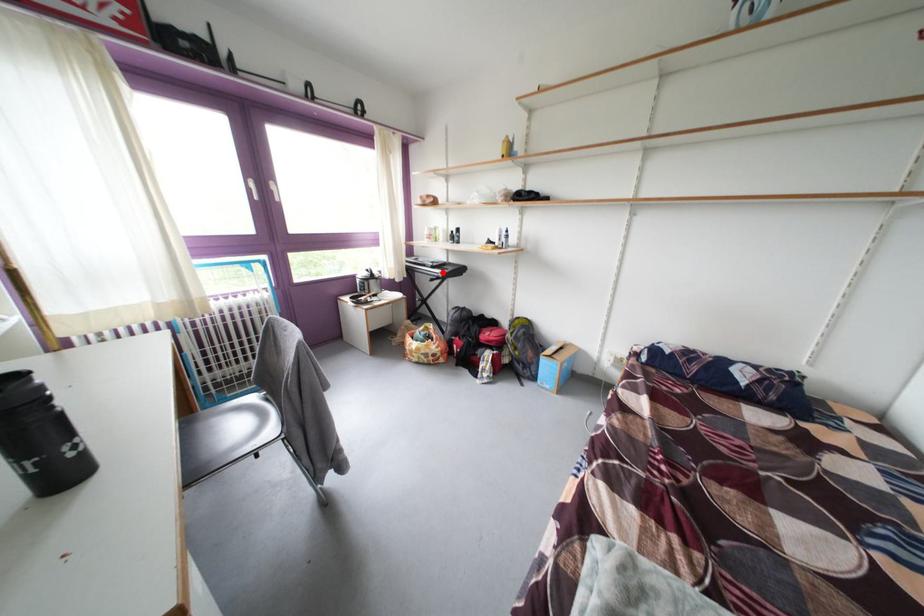
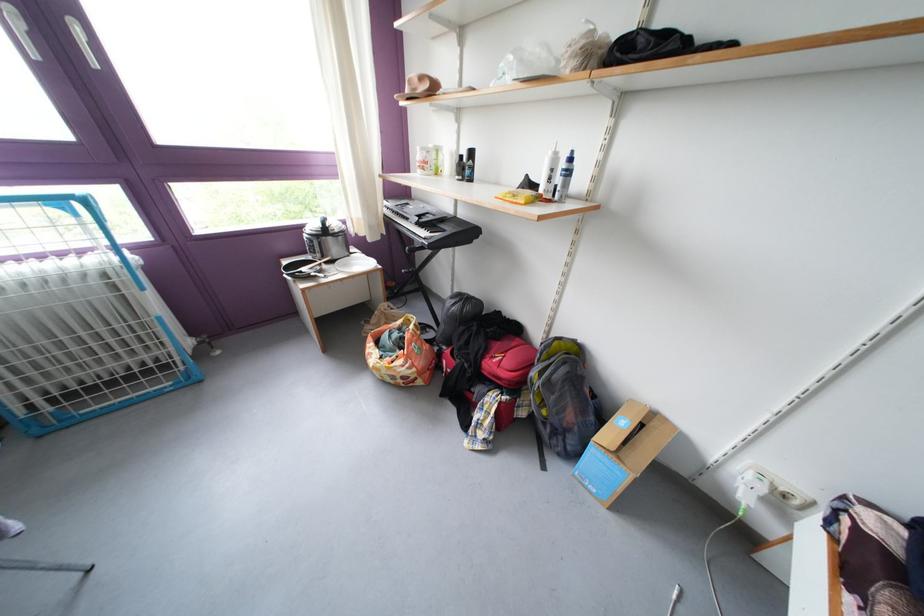
In the second image, find the point that corresponds to the highlighted location in the first image.

(430, 229)